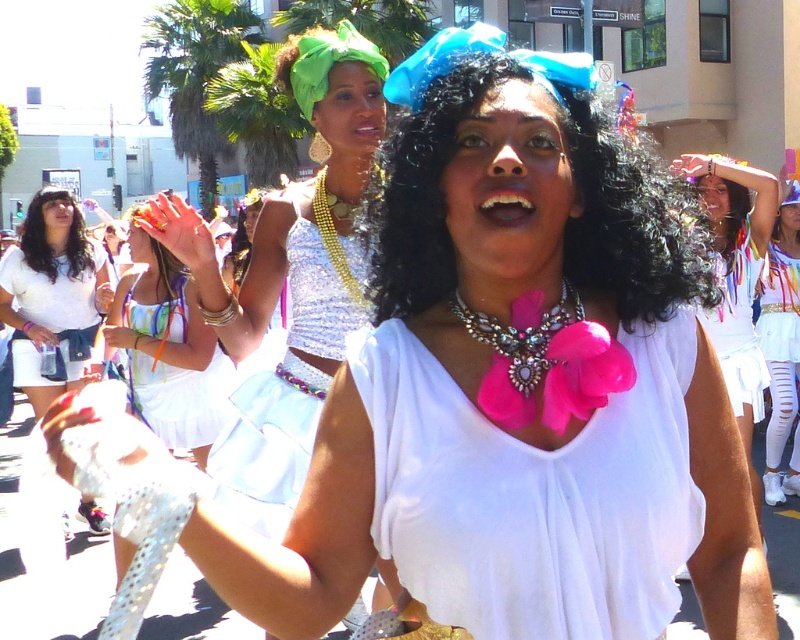
Can you confirm if white cotton shirt at center is bigger than pink satin bow at center?

No, white cotton shirt at center is not bigger than pink satin bow at center.

Does white cotton shirt at center appear over pink satin bow at center?

Indeed, white cotton shirt at center is positioned over pink satin bow at center.

I want to click on white cotton shirt at center, so click(52, 298).

This screenshot has height=640, width=800. Describe the element at coordinates (628, 220) in the screenshot. I see `black curly hair at center` at that location.

Is black curly hair at center smaller than white satin skirt at lower right?

Yes, black curly hair at center is smaller than white satin skirt at lower right.

Does point (440, 248) lie behind point (770, 481)?

That is False.

In order to click on black curly hair at center in this screenshot , I will do 628,220.

Between shiny silver top at center and white cotton shirt at center, which one has less height?

white cotton shirt at center

Can you confirm if shiny silver top at center is positioned above white cotton shirt at center?

Indeed, shiny silver top at center is positioned over white cotton shirt at center.

Is point (378, 125) behind point (46, 348)?

No, it is not.

Locate an element on the screen. The height and width of the screenshot is (640, 800). shiny silver top at center is located at coordinates (290, 276).